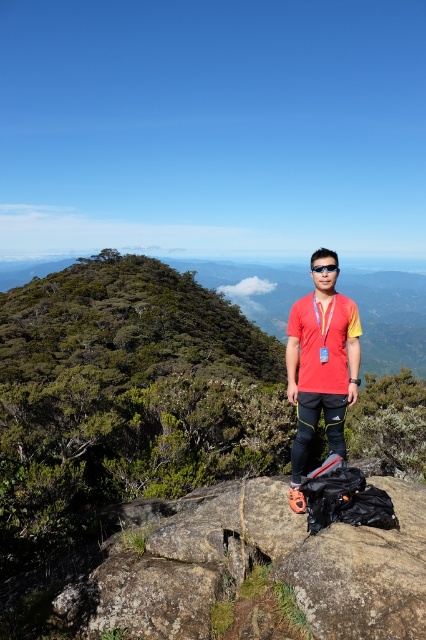
From the picture: You are a hiker who has just found the red plastic goggles at center and the rough granite rock at center. You want to place the goggles on top of the rock. Is the rock currently under the goggles?

The rough granite rock at center is positioned under red plastic goggles at center, so yes, the rock is currently under the goggles, making it possible to place them on top.

You are a hiker wearing a red matte shirt at center and standing near a rough granite rock at center. You want to take a photo where your shirt is visible next to the rock. Will the shirt appear wider than the rock in the photo?

The rough granite rock at center is wider than the red matte shirt at center, so the shirt will not appear wider than the rock in the photo.

You are a hiker who just found the red plastic goggles at center near the rough granite rock at center. You want to place them on the rock so they are exactly 2 meters away from the edge of the rock. Can you do that?

The rough granite rock at center and red plastic goggles at center are 3.21 meters apart. Since the distance between them is more than 2 meters, you can move the goggles closer to the rock so they are exactly 2 meters away from the edge.